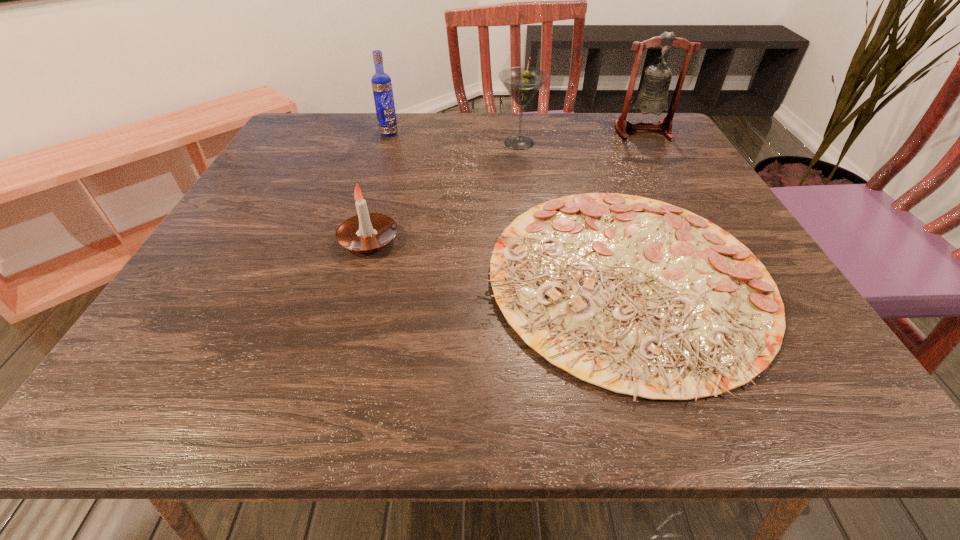
Identify the location of bell that is at the far edge. Image resolution: width=960 pixels, height=540 pixels. (651, 97).

Where is `vodka present at the far edge`? This screenshot has height=540, width=960. vodka present at the far edge is located at coordinates (381, 82).

The width and height of the screenshot is (960, 540). In order to click on martini that is at the far edge in this screenshot , I will do `click(522, 83)`.

Where is `object situated at the near edge`? object situated at the near edge is located at coordinates (640, 297).

I want to click on bell that is at the right edge, so click(651, 97).

I want to click on pizza that is at the right edge, so click(640, 297).

Find the location of a particular element. This screenshot has width=960, height=540. object located at the far right corner is located at coordinates (651, 97).

At what (x,y) coordinates should I click in order to perform the action: click on object located at the near right corner. Please return your answer as a coordinate pair (x, y). The height and width of the screenshot is (540, 960). Looking at the image, I should click on (640, 297).

In the image, there is a desktop. At what (x,y) coordinates should I click in order to perform the action: click on vacant space at the far edge. Please return your answer as a coordinate pair (x, y). This screenshot has width=960, height=540. Looking at the image, I should click on (567, 118).

At what (x,y) coordinates should I click in order to perform the action: click on vacant space at the near edge. Please return your answer as a coordinate pair (x, y). Looking at the image, I should click on (520, 388).